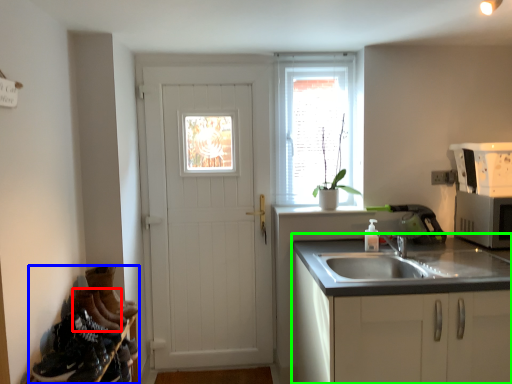
Question: Which is nearer to the shoe (highlighted by a red box)? shelf (highlighted by a blue box) or cabinetry (highlighted by a green box).

Choices:
 (A) shelf
 (B) cabinetry

Answer: (A)